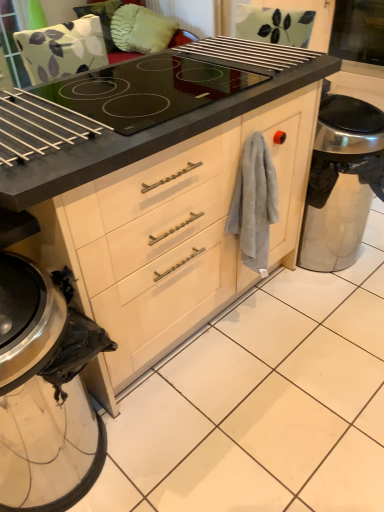
Question: Is satin silver trash can at lower right beside gray cotton towel at right?

Choices:
 (A) yes
 (B) no

Answer: (B)

Question: Is satin silver trash can at lower right smaller than gray cotton towel at right?

Choices:
 (A) no
 (B) yes

Answer: (A)

Question: Is satin silver trash can at lower right facing towards gray cotton towel at right?

Choices:
 (A) yes
 (B) no

Answer: (B)

Question: From a real-world perspective, is satin silver trash can at lower right beneath gray cotton towel at right?

Choices:
 (A) no
 (B) yes

Answer: (B)

Question: Can you confirm if satin silver trash can at lower right is positioned to the right of gray cotton towel at right?

Choices:
 (A) yes
 (B) no

Answer: (A)

Question: Considering the relative positions of transparent glass screen door at upper right and metallic silver trash can at lower left in the image provided, is transparent glass screen door at upper right to the left or to the right of metallic silver trash can at lower left?

Choices:
 (A) right
 (B) left

Answer: (A)

Question: In terms of height, does transparent glass screen door at upper right look taller or shorter compared to metallic silver trash can at lower left?

Choices:
 (A) short
 (B) tall

Answer: (A)

Question: From a real-world perspective, relative to metallic silver trash can at lower left, is transparent glass screen door at upper right vertically above or below?

Choices:
 (A) above
 (B) below

Answer: (A)

Question: In the image, is transparent glass screen door at upper right positioned in front of or behind metallic silver trash can at lower left?

Choices:
 (A) front
 (B) behind

Answer: (B)

Question: From the image's perspective, is satin silver trash can at lower right above or below gray cotton towel at right?

Choices:
 (A) above
 (B) below

Answer: (A)

Question: Considering their positions, is satin silver trash can at lower right located in front of or behind gray cotton towel at right?

Choices:
 (A) behind
 (B) front

Answer: (A)

Question: Is satin silver trash can at lower right taller or shorter than gray cotton towel at right?

Choices:
 (A) short
 (B) tall

Answer: (B)

Question: Would you say satin silver trash can at lower right is to the left or to the right of gray cotton towel at right in the picture?

Choices:
 (A) left
 (B) right

Answer: (B)

Question: In terms of width, does satin silver trash can at lower right look wider or thinner when compared to metallic silver trash can at lower left?

Choices:
 (A) thin
 (B) wide

Answer: (A)

Question: Is satin silver trash can at lower right to the left or to the right of metallic silver trash can at lower left in the image?

Choices:
 (A) right
 (B) left

Answer: (A)